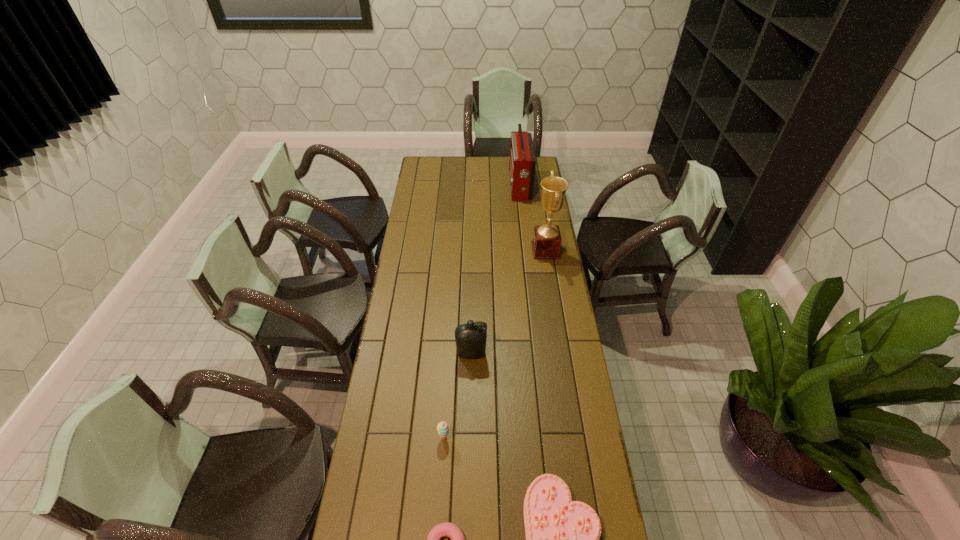
In the image, there is a desktop. Where is `free region at the far edge`? This screenshot has width=960, height=540. free region at the far edge is located at coordinates (495, 170).

In order to click on vacant space at the left edge of the desktop in this screenshot , I will do `click(422, 195)`.

Find the location of a particular element. blank space at the right edge of the desktop is located at coordinates (588, 478).

Identify the location of vacant region at the far left corner. This screenshot has height=540, width=960. (431, 170).

Where is `vacant area that lies between the second farthest object and the fifth shortest object`? vacant area that lies between the second farthest object and the fifth shortest object is located at coordinates coord(533,218).

Find the location of `free space between the fifth nearest object and the bottle`. free space between the fifth nearest object and the bottle is located at coordinates (509, 302).

I want to click on vacant area between the bottle and the second tallest object, so click(495, 269).

Select which object is the fourth closest to the fourth tallest object. Please provide its 2D coordinates. Your answer should be formatted as a tuple, i.e. [(x, y)], where the tuple contains the x and y coordinates of a point satisfying the conditions above.

[(546, 244)]

Find the location of a particular element. This screenshot has width=960, height=540. object that can be found as the second closest to the shortest object is located at coordinates (442, 428).